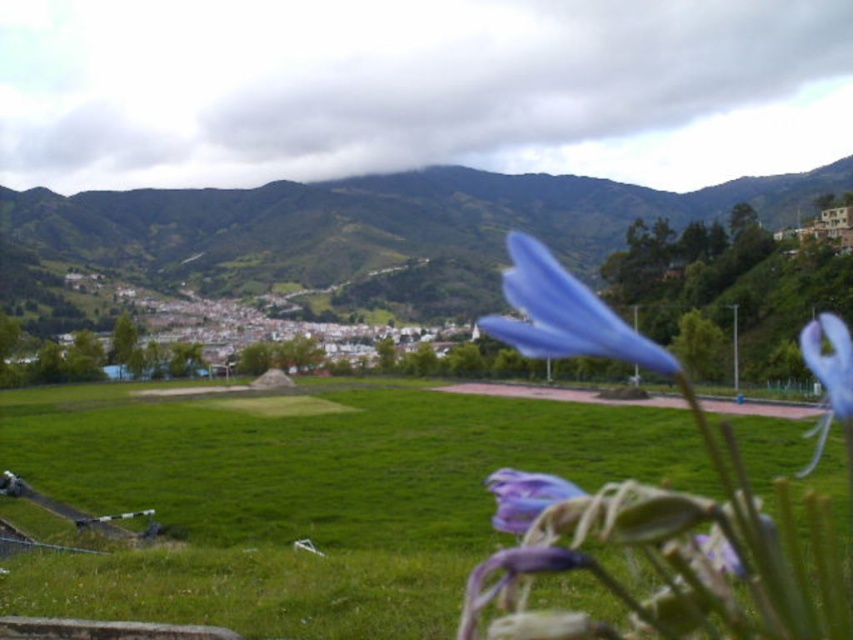
You are a photographer standing at the edge of the field. You want to take a photo that includes both the blue matte flower at center and the purple matte flower at center. Given that your camera has a maximum zoom range of 50 meters, will you need to move closer to capture both flowers in the same frame?

The distance between the blue matte flower at center and the purple matte flower at center is 63.19 meters, which exceeds the camera maximum zoom range of 50 meters. Therefore, you will need to move closer to ensure both flowers are within the frame.

You are a photographer standing at the edge of the green field. You want to capture a photo where the blue matte flower at center is perfectly centered in the frame. Given the flower is at coordinates 0.492 on the x and 0.662 on the y, would adjusting the camera focus to the center point help capture the flower clearly?

Yes, since the blue matte flower at center is located at coordinates approximately 0.492 on the x and 0.662 on the y, aligning the camera focus to the center point would ensure it is in clear focus.

You are standing in the middle of the green field and see two points marked on the ground. One is at point (154,237) and the other is at point (805,349). Which point is closer to you?

Point (154,237) is closer to you because it is further to the camera than point (805,349).